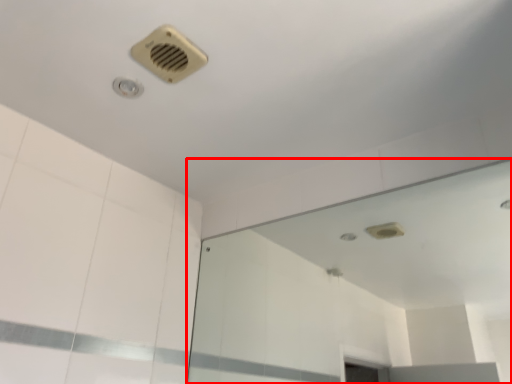
Question: From the image's perspective, considering the relative positions of mirror (annotated by the red box) and air conditioning in the image provided, where is mirror (annotated by the red box) located with respect to the staircase?

Choices:
 (A) below
 (B) above

Answer: (A)